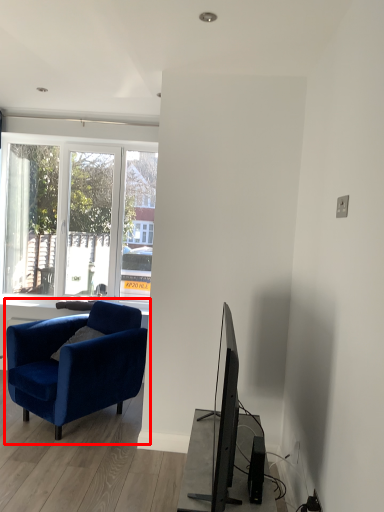
Question: From the image's perspective, what is the correct spatial positioning of chair (annotated by the red box) in reference to speaker?

Choices:
 (A) below
 (B) above

Answer: (B)